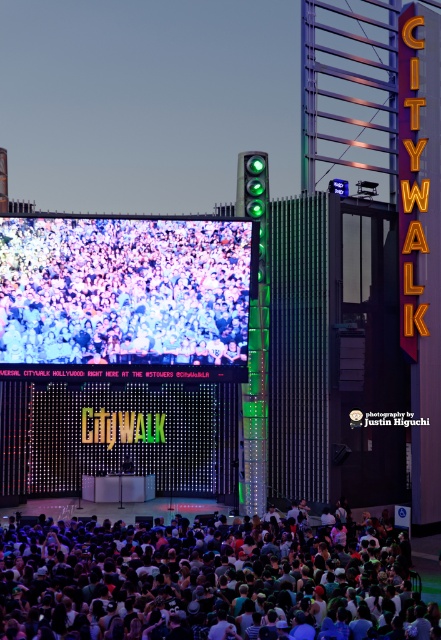
Can you confirm if dark gray fabric crowd at lower center is bigger than multicolored fabric crowd at center?

Indeed, dark gray fabric crowd at lower center has a larger size compared to multicolored fabric crowd at center.

Does dark gray fabric crowd at lower center have a greater height compared to multicolored fabric crowd at center?

No.

Locate an element on the screen. This screenshot has width=441, height=640. dark gray fabric crowd at lower center is located at coordinates (209, 580).